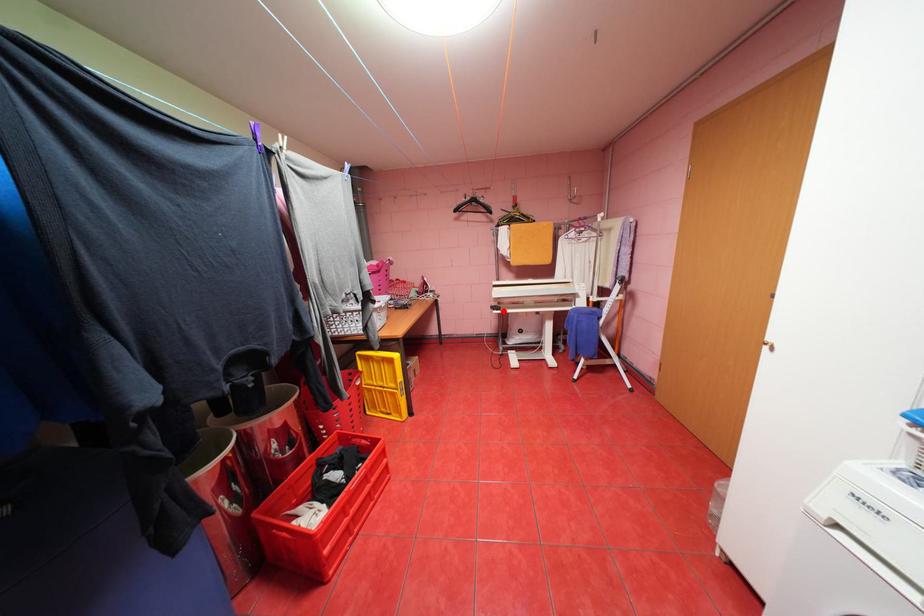
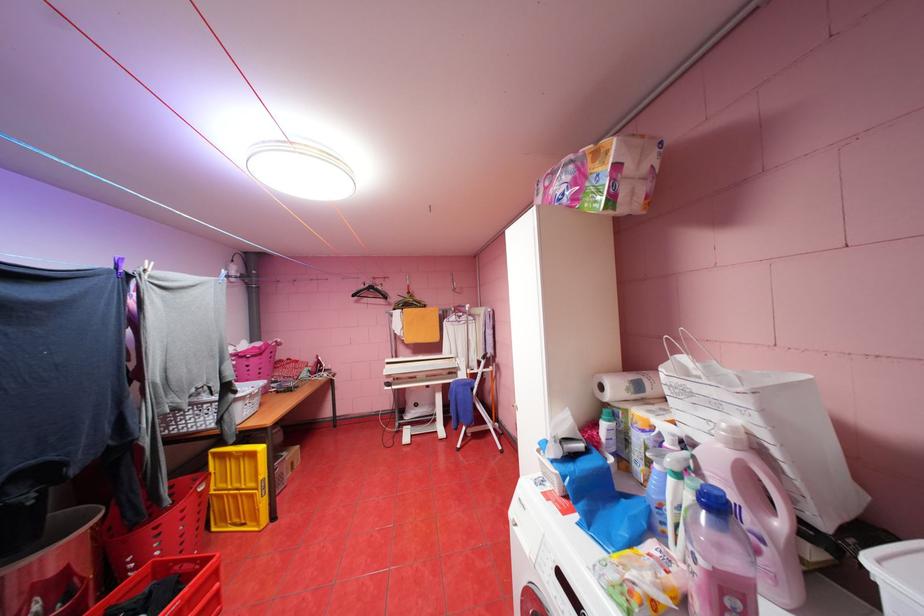
Where in the second image is the point corresponding to the highlighted location from the first image?

(395, 387)